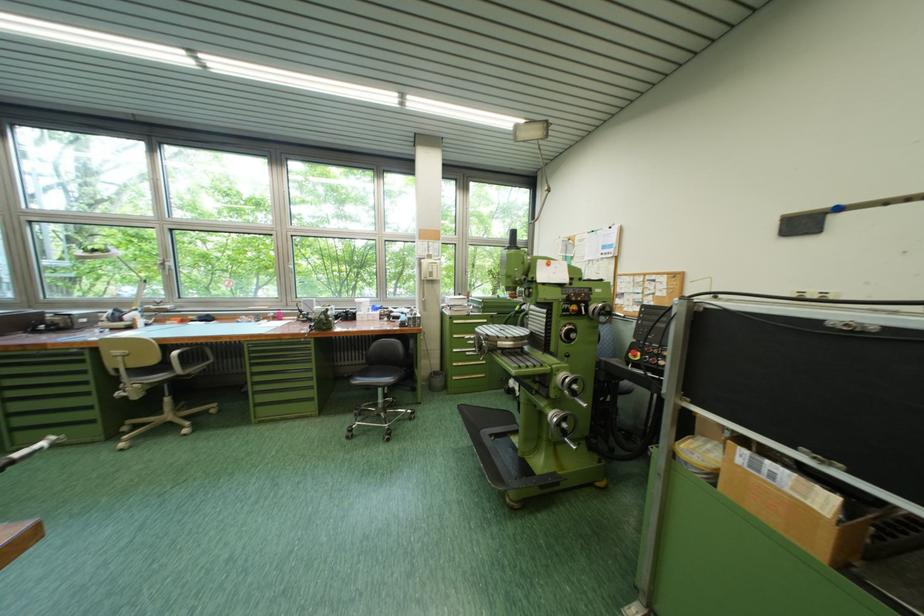
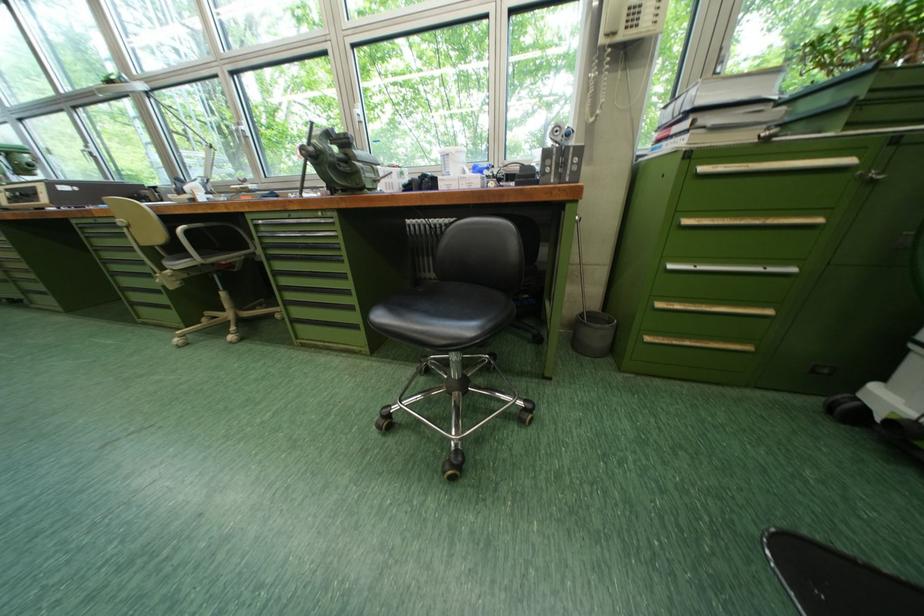
Where in the second image is the point corresponding to (x=378, y=369) from the first image?

(448, 284)